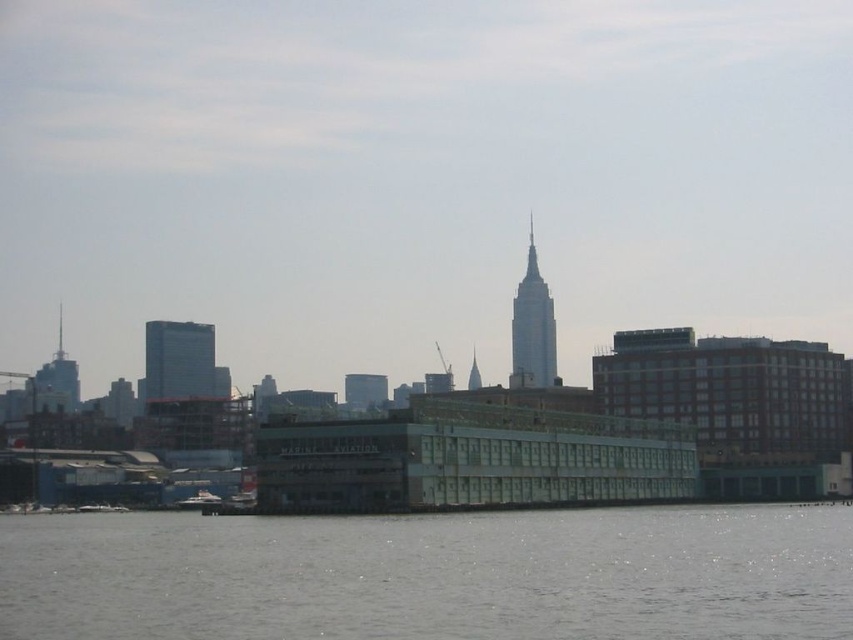
You are a photographer planning to capture the entire waterfront scene in one shot. Given that the gray water at lower center and the white glossy boat at lower left are both in your frame, which object occupies more horizontal space in the image?

The gray water at lower center occupies more horizontal space in the image because its width is larger than that of the white glossy boat at lower left.

You are a photographer planning to capture the silver glass skyscraper at center and the white glossy boat at lower left in a single frame. Considering their sizes in the image, which one will appear larger in your photo?

The silver glass skyscraper at center will appear larger in the photo because it is taller than the white glossy boat at lower left.